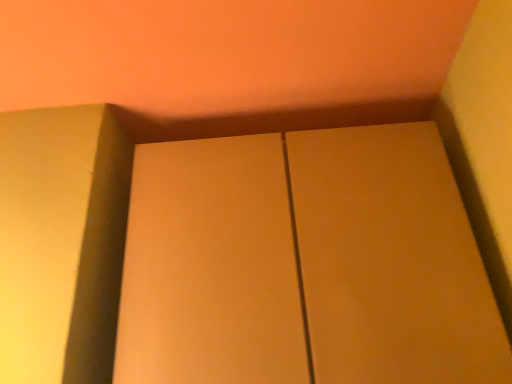
Find the location of a particular element. matte wood door at center is located at coordinates point(391,261).

What do you see at coordinates (391, 261) in the screenshot? The width and height of the screenshot is (512, 384). I see `matte wood door at center` at bounding box center [391, 261].

Image resolution: width=512 pixels, height=384 pixels. In order to click on matte wood door at center in this screenshot , I will do `click(391, 261)`.